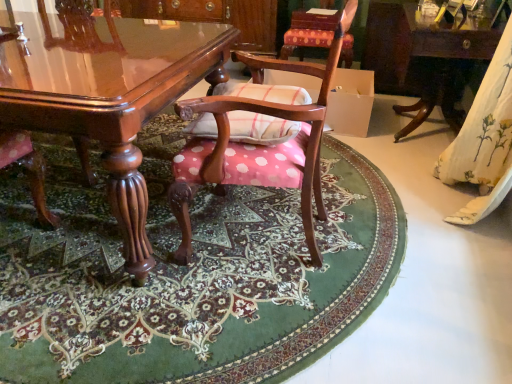
Question: From a real-world perspective, is glossy wood table at center, the second table viewed from the right, on polka dot fabric chair at center, which ranks as the second chair in back-to-front order?

Choices:
 (A) no
 (B) yes

Answer: (A)

Question: Does glossy wood table at center, the second table viewed from the right, have a greater height compared to polka dot fabric chair at center, arranged as the 2th chair when viewed from the top?

Choices:
 (A) no
 (B) yes

Answer: (A)

Question: Could you tell me if glossy wood table at center, which is the 1th table from left to right, is turned towards polka dot fabric chair at center, which ranks as the second chair in back-to-front order?

Choices:
 (A) yes
 (B) no

Answer: (B)

Question: Considering the relative sizes of glossy wood table at center, the second table viewed from the right, and polka dot fabric chair at center, arranged as the 2th chair when viewed from the top, in the image provided, is glossy wood table at center, the second table viewed from the right, shorter than polka dot fabric chair at center, arranged as the 2th chair when viewed from the top,?

Choices:
 (A) no
 (B) yes

Answer: (B)

Question: From the image's perspective, does glossy wood table at center, the second table viewed from the right, appear higher than polka dot fabric chair at center, arranged as the 2th chair when viewed from the top?

Choices:
 (A) yes
 (B) no

Answer: (A)

Question: From a real-world perspective, is polka dot fabric chair at center, the first chair from the front, above or below wooden table at right, which is the second table in left-to-right order?

Choices:
 (A) below
 (B) above

Answer: (B)

Question: In terms of size, does polka dot fabric chair at center, the first chair from the front, appear bigger or smaller than wooden table at right, which ranks as the 1th table in right-to-left order?

Choices:
 (A) small
 (B) big

Answer: (A)

Question: From the image's perspective, is polka dot fabric chair at center, the 1th chair ordered from the bottom, above or below wooden table at right, which ranks as the 1th table in right-to-left order?

Choices:
 (A) above
 (B) below

Answer: (B)

Question: Is polka dot fabric chair at center, which ranks as the second chair in back-to-front order, to the left or to the right of wooden table at right, which is the second table in left-to-right order, in the image?

Choices:
 (A) right
 (B) left

Answer: (B)

Question: From the image's perspective, is wooden table at right, which is the second table in left-to-right order, located above or below polka dot fabric chair at center, which is counted as the 1th chair, starting from the back?

Choices:
 (A) below
 (B) above

Answer: (A)

Question: Considering the positions of wooden table at right, which is the second table in left-to-right order, and polka dot fabric chair at center, the first chair from the top, in the image, is wooden table at right, which is the second table in left-to-right order, wider or thinner than polka dot fabric chair at center, the first chair from the top,?

Choices:
 (A) thin
 (B) wide

Answer: (B)

Question: In the image, is wooden table at right, which ranks as the 1th table in right-to-left order, on the left side or the right side of polka dot fabric chair at center, acting as the 2th chair starting from the front?

Choices:
 (A) left
 (B) right

Answer: (B)

Question: Considering the positions of point (411, 46) and point (294, 26), is point (411, 46) closer or farther from the camera than point (294, 26)?

Choices:
 (A) farther
 (B) closer

Answer: (B)

Question: Looking at the image, does pink polka dot fabric at center seem bigger or smaller compared to polka dot fabric chair at center, which is counted as the 1th chair, starting from the back?

Choices:
 (A) big
 (B) small

Answer: (A)

Question: Is pink polka dot fabric at center spatially inside polka dot fabric chair at center, the first chair from the top, or outside of it?

Choices:
 (A) outside
 (B) inside

Answer: (A)